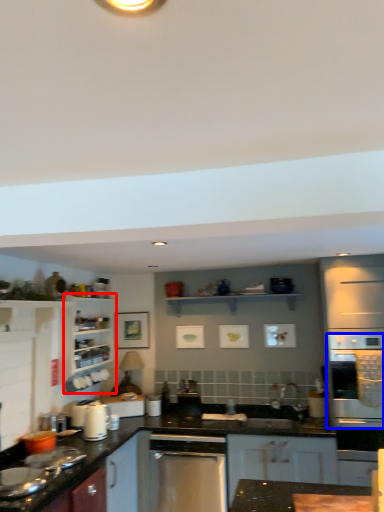
Question: Among these objects, which one is farthest to the camera, cabinetry (highlighted by a red box) or oven (highlighted by a blue box)?

Choices:
 (A) cabinetry
 (B) oven

Answer: (A)